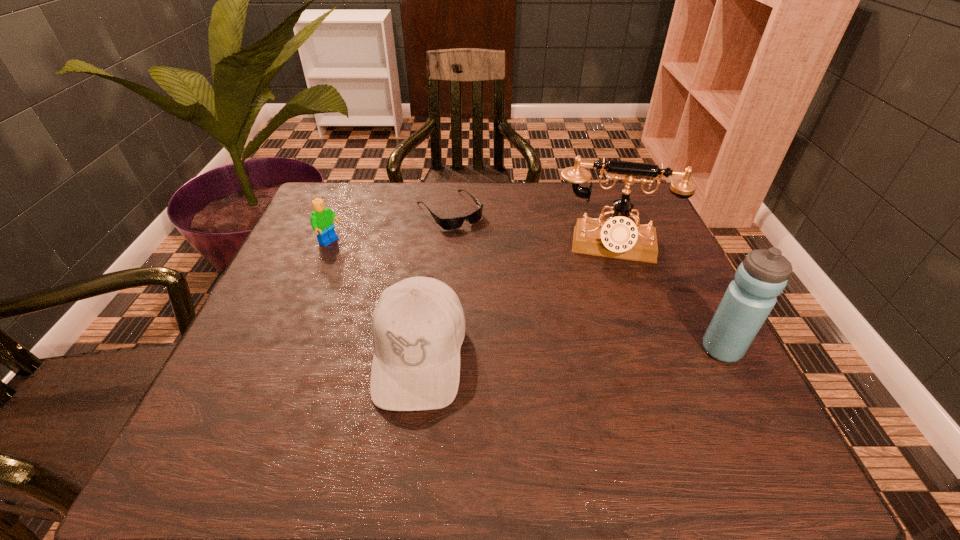
Identify the location of telephone at the right edge. (619, 237).

In order to click on object that is at the far right corner in this screenshot , I will do `click(619, 237)`.

This screenshot has width=960, height=540. I want to click on free spot at the far edge of the desktop, so click(583, 202).

Locate an element on the screen. free space at the near edge is located at coordinates (575, 388).

Identify the location of free region at the left edge of the desktop. (340, 286).

I want to click on free space at the right edge of the desktop, so click(x=625, y=304).

I want to click on vacant region at the far left corner of the desktop, so click(357, 201).

The height and width of the screenshot is (540, 960). What are the coordinates of `free region at the far right corner of the desktop` in the screenshot? It's located at (632, 219).

Locate an element on the screen. vacant area that lies between the Lego and the sunglasses is located at coordinates (391, 226).

You are a GUI agent. You are given a task and a screenshot of the screen. Output one action in this format:
    pyautogui.click(x=<x>, y=<y>)
    Task: Click on the vacant area between the telephone and the water bottle
    
    Given the screenshot: What is the action you would take?
    pyautogui.click(x=666, y=297)